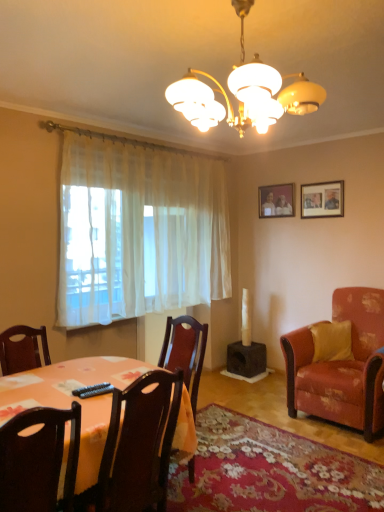
Question: From a real-world perspective, is velvet orange armchair at right, positioned as the third chair in front-to-back order, located beneath white sheer curtain at left?

Choices:
 (A) no
 (B) yes

Answer: (B)

Question: Is velvet orange armchair at right, which is counted as the 3th chair, starting from the left, wider than white sheer curtain at left?

Choices:
 (A) yes
 (B) no

Answer: (A)

Question: Is velvet orange armchair at right, positioned as the third chair in front-to-back order, further to camera compared to white sheer curtain at left?

Choices:
 (A) no
 (B) yes

Answer: (A)

Question: From the image's perspective, is velvet orange armchair at right, which is counted as the 3th chair, starting from the left, below white sheer curtain at left?

Choices:
 (A) no
 (B) yes

Answer: (B)

Question: Could you tell me if velvet orange armchair at right, which appears as the first chair when viewed from the back, is turned towards white sheer curtain at left?

Choices:
 (A) yes
 (B) no

Answer: (B)

Question: Considering the positions of white frosted glass chandelier at upper center and wooden photo frame at upper center, the 2th picture frame positioned from the front, in the image, is white frosted glass chandelier at upper center wider or thinner than wooden photo frame at upper center, the 2th picture frame positioned from the front,?

Choices:
 (A) wide
 (B) thin

Answer: (A)

Question: Visually, is white frosted glass chandelier at upper center positioned to the left or to the right of wooden photo frame at upper center, the first picture frame when ordered from back to front?

Choices:
 (A) right
 (B) left

Answer: (B)

Question: From a real-world perspective, is white frosted glass chandelier at upper center physically located above or below wooden photo frame at upper center, the first picture frame when ordered from back to front?

Choices:
 (A) above
 (B) below

Answer: (A)

Question: Is point (230, 79) closer or farther from the camera than point (264, 212)?

Choices:
 (A) farther
 (B) closer

Answer: (B)

Question: From the image's perspective, is yellow fabric pillow at right positioned above or below dark wood chair at lower left, marked as the 1th chair in a left-to-right arrangement?

Choices:
 (A) below
 (B) above

Answer: (B)

Question: Is point (334, 335) closer or farther from the camera than point (29, 467)?

Choices:
 (A) farther
 (B) closer

Answer: (A)

Question: In terms of height, does yellow fabric pillow at right look taller or shorter compared to dark wood chair at lower left, which is the 3th chair from right to left?

Choices:
 (A) tall
 (B) short

Answer: (B)

Question: From a real-world perspective, is yellow fabric pillow at right above or below dark wood chair at lower left, which is the 3th chair from right to left?

Choices:
 (A) below
 (B) above

Answer: (A)

Question: From their relative heights in the image, would you say black plastic remote control at lower center is taller or shorter than wooden picture frame at upper right, which is the second picture frame from left to right?

Choices:
 (A) tall
 (B) short

Answer: (B)

Question: Is point (96, 393) closer or farther from the camera than point (339, 206)?

Choices:
 (A) farther
 (B) closer

Answer: (B)